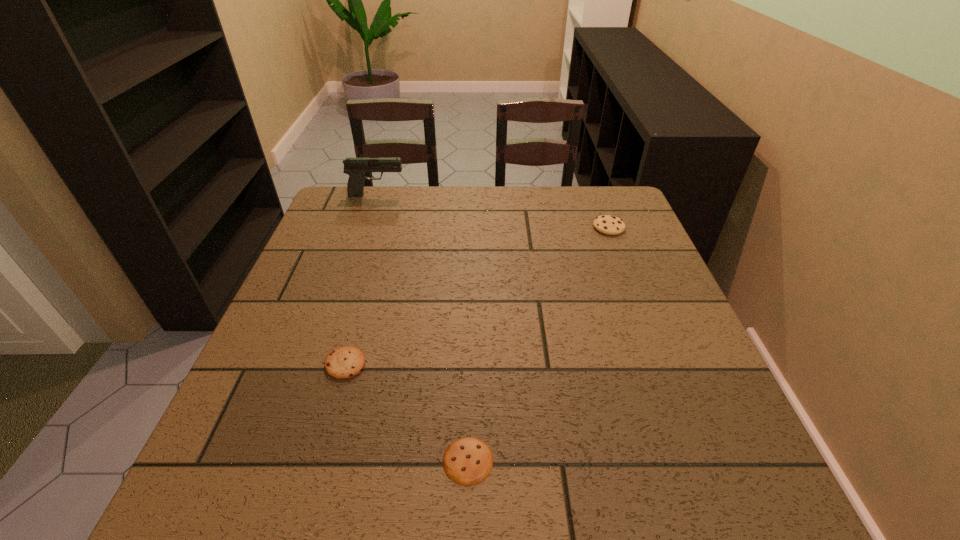
Locate an element on the screen. The width and height of the screenshot is (960, 540). vacant area situated 0.090m on the back of the second tallest cookie is located at coordinates click(359, 318).

The height and width of the screenshot is (540, 960). What are the coordinates of `free spot located on the back of the shortest object` in the screenshot? It's located at (469, 384).

Find the location of `pistol that is at the far edge`. pistol that is at the far edge is located at coordinates (355, 167).

The width and height of the screenshot is (960, 540). What are the coordinates of `cookie that is at the far edge` in the screenshot? It's located at point(607,224).

Locate an element on the screen. This screenshot has width=960, height=540. object that is at the near edge is located at coordinates [467, 461].

Find the location of a particular element. The height and width of the screenshot is (540, 960). pistol that is at the left edge is located at coordinates (355, 167).

Identify the location of cookie that is at the left edge. The height and width of the screenshot is (540, 960). (345, 362).

Where is `object that is at the right edge`? This screenshot has height=540, width=960. object that is at the right edge is located at coordinates pyautogui.click(x=607, y=224).

Identify the location of object that is at the far left corner. (355, 167).

This screenshot has width=960, height=540. Find the location of `object that is at the far right corner`. object that is at the far right corner is located at coordinates (607, 224).